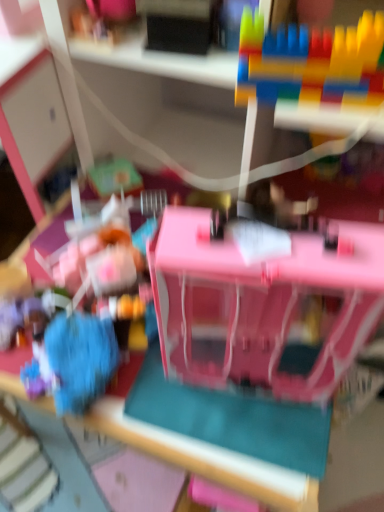
Where is `free spot to the right of blue fuzzy ball at lower left, the 3th toy when ordered from top to bottom`? The height and width of the screenshot is (512, 384). free spot to the right of blue fuzzy ball at lower left, the 3th toy when ordered from top to bottom is located at coordinates (165, 390).